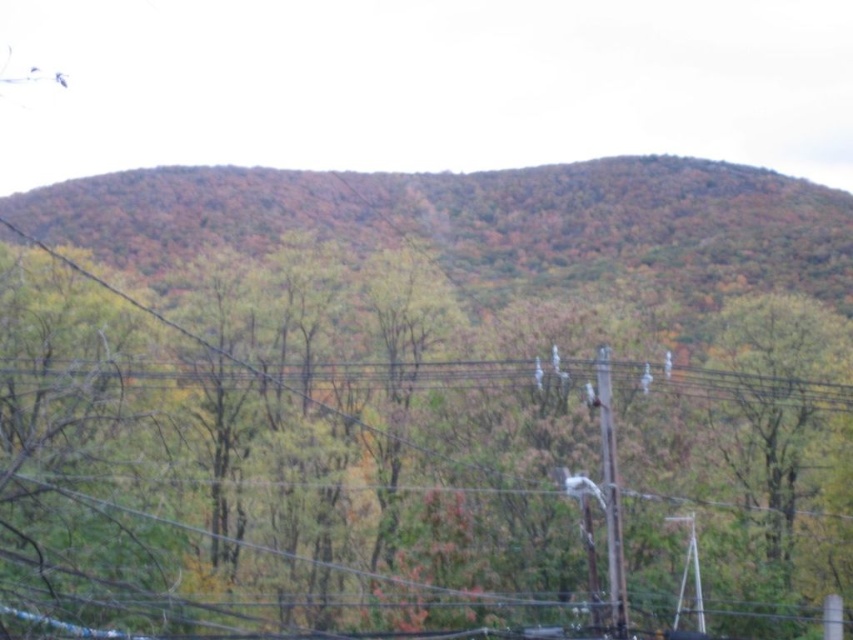
You are standing at the base of the hill in the image and notice a point marked at coordinates (281, 467). What object is located at that point?

The point at coordinates (281, 467) indicates a green matte tree at center.